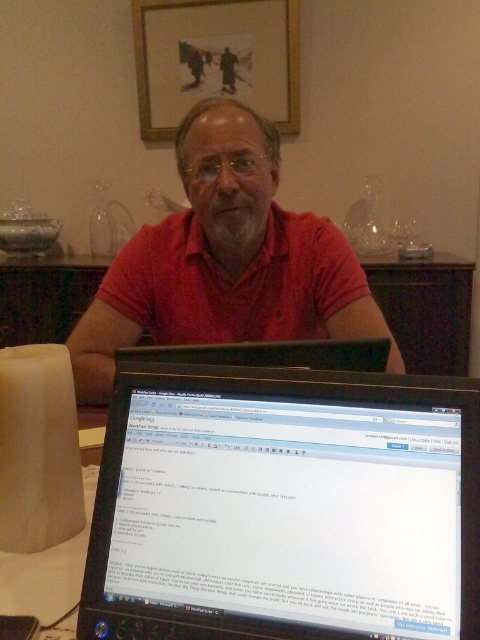
Looking at this image, you are a photographer trying to capture a clear shot of the wooden framed picture at upper center and the matte red shirt at center. Since you can only focus on one object at a time, which object should you choose to ensure it appears larger in the photo?

The matte red shirt at center is larger in size than the wooden framed picture at upper center, so focusing on the matte red shirt at center will make it appear larger in the photo.

You are a delivery person trying to place a small package on the table in front of the man. The package must be placed precisely at the coordinates corresponding to point (x=285, y=506) on the table. However, there is an object at that location. What object is blocking the placement of the package?

The point (x=285, y=506) is on the black glossy laptop at lower center, so the black glossy laptop at lower center is blocking the placement of the package.

You are designing a layout for a magazine cover and need to place two elements based on their sizes. The matte red shirt at center and the wooden framed picture at upper center. Which element should you choose if you need to place a larger object on the cover?

The wooden framed picture at upper center should be chosen because its width is greater than the matte red shirt at center.